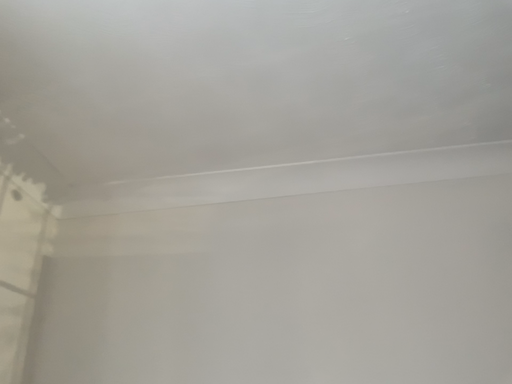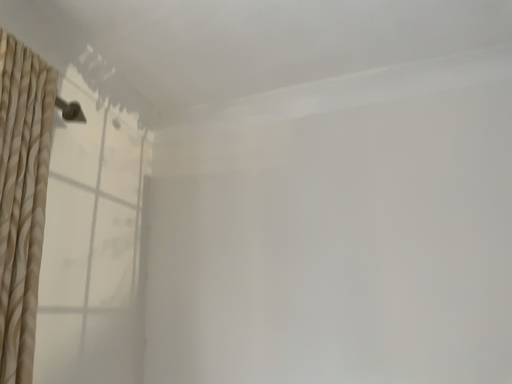
Question: How did the camera likely rotate when shooting the video?

Choices:
 (A) rotated right
 (B) rotated left

Answer: (B)